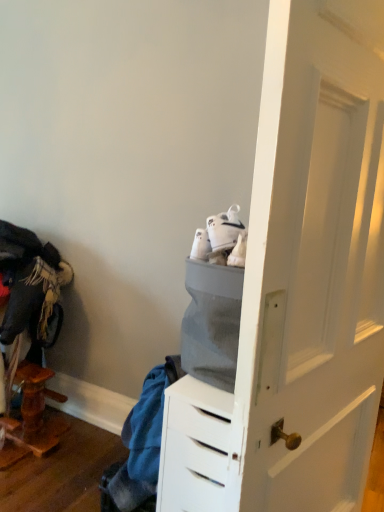
In order to click on white suede sneakers at center in this screenshot , I will do `click(224, 229)`.

What do you see at coordinates (224, 229) in the screenshot? The height and width of the screenshot is (512, 384). I see `white suede sneakers at center` at bounding box center [224, 229].

What do you see at coordinates (141, 444) in the screenshot? This screenshot has width=384, height=512. I see `blue fabric at lower left` at bounding box center [141, 444].

What are the coordinates of `blue fabric at lower left` in the screenshot? It's located at (141, 444).

Locate an element on the screen. The image size is (384, 512). white suede sneakers at center is located at coordinates (224, 229).

Which object is positioned more to the left, blue fabric at lower left or white suede sneakers at center?

blue fabric at lower left.

Considering the relative positions of blue fabric at lower left and white suede sneakers at center in the image provided, is blue fabric at lower left behind white suede sneakers at center?

Yes.

Between point (160, 425) and point (221, 217), which one is positioned behind?

Positioned behind is point (160, 425).

From the image's perspective, is blue fabric at lower left over white suede sneakers at center?

No, from the image's perspective, blue fabric at lower left is not over white suede sneakers at center.

From a real-world perspective, is blue fabric at lower left located beneath white suede sneakers at center?

Yes.

Does blue fabric at lower left have a lesser width compared to white suede sneakers at center?

In fact, blue fabric at lower left might be wider than white suede sneakers at center.

From their relative heights in the image, would you say blue fabric at lower left is taller or shorter than white suede sneakers at center?

Clearly, blue fabric at lower left is taller compared to white suede sneakers at center.

Does blue fabric at lower left have a larger size compared to white suede sneakers at center?

Yes.

Can white suede sneakers at center be found inside blue fabric at lower left?

That's incorrect, white suede sneakers at center is not inside blue fabric at lower left.

Are blue fabric at lower left and white suede sneakers at center located far from each other?

No, blue fabric at lower left is in close proximity to white suede sneakers at center.

Is blue fabric at lower left looking in the opposite direction of white suede sneakers at center?

No, white suede sneakers at center is not at the back of blue fabric at lower left.

How distant is blue fabric at lower left from white suede sneakers at center?

blue fabric at lower left and white suede sneakers at center are 29.95 inches apart from each other.

The height and width of the screenshot is (512, 384). Identify the location of clothing behind the white suede sneakers at center. (141, 444).

Which is more to the right, white suede sneakers at center or blue fabric at lower left?

white suede sneakers at center is more to the right.

Is white suede sneakers at center in front of blue fabric at lower left?

Yes, the depth of white suede sneakers at center is less than that of blue fabric at lower left.

Is point (236, 210) closer to camera compared to point (141, 504)?

Yes, it is.

From the image's perspective, which is below, white suede sneakers at center or blue fabric at lower left?

blue fabric at lower left appears lower in the image.

From a real-world perspective, is white suede sneakers at center on top of blue fabric at lower left?

Yes, from a real-world perspective, white suede sneakers at center is over blue fabric at lower left

In terms of width, does white suede sneakers at center look wider or thinner when compared to blue fabric at lower left?

In the image, white suede sneakers at center appears to be more narrow than blue fabric at lower left.

Is white suede sneakers at center taller than blue fabric at lower left?

No, white suede sneakers at center is not taller than blue fabric at lower left.

Considering the sizes of objects white suede sneakers at center and blue fabric at lower left in the image provided, who is smaller, white suede sneakers at center or blue fabric at lower left?

With smaller size is white suede sneakers at center.

Is blue fabric at lower left located within white suede sneakers at center?

Definitely not — blue fabric at lower left is not inside white suede sneakers at center.

Are white suede sneakers at center and blue fabric at lower left beside each other?

white suede sneakers at center is not next to blue fabric at lower left, and they're not touching.

Is white suede sneakers at center facing towards blue fabric at lower left?

No, white suede sneakers at center is not facing towards blue fabric at lower left.

Identify the location of footwear above the blue fabric at lower left (from the image's perspective). (224, 229).

Locate an element on the screen. Image resolution: width=384 pixels, height=512 pixels. clothing on the left of white suede sneakers at center is located at coordinates (141, 444).

Image resolution: width=384 pixels, height=512 pixels. I want to click on footwear on the right of blue fabric at lower left, so click(x=224, y=229).